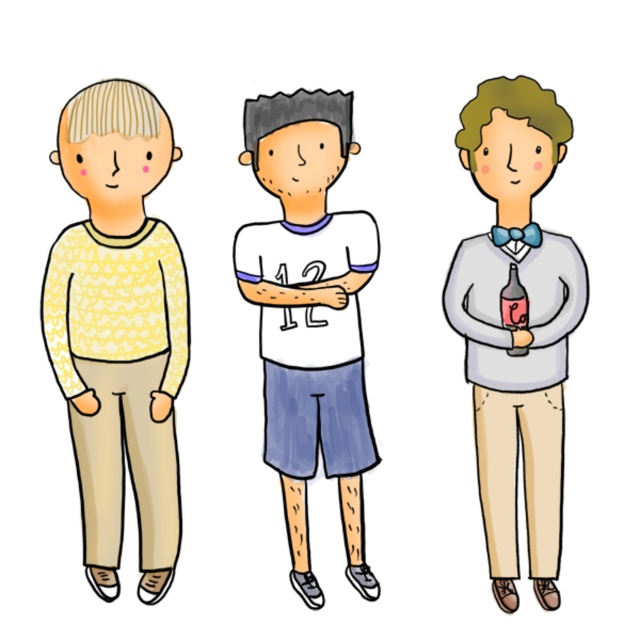
Which is in front, point (124, 280) or point (282, 472)?

Positioned in front is point (124, 280).

Is yellow textured sweater at left below white jersey at center?

No, yellow textured sweater at left is not below white jersey at center.

Find the location of `yellow textured sweater at left`. yellow textured sweater at left is located at coordinates (120, 328).

Who is higher up, yellow textured sweater at left or translucent glass bottle at center?

translucent glass bottle at center is above.

Consider the image. Who is more distant from viewer, (77, 308) or (513, 330)?

The point (513, 330) is behind.

Is point (52, 301) positioned after point (518, 284)?

No, (52, 301) is in front of (518, 284).

You are a GUI agent. You are given a task and a screenshot of the screen. Output one action in this format:
    pyautogui.click(x=<x>, y=<y>)
    Task: Click on the yellow textured sweater at left
    
    Given the screenshot: What is the action you would take?
    pyautogui.click(x=120, y=328)

Is point (544, 436) positioned behind point (355, 384)?

No, it is in front of (355, 384).

The image size is (640, 640). What are the coordinates of `matte gray sweater at right` in the screenshot? It's located at (518, 330).